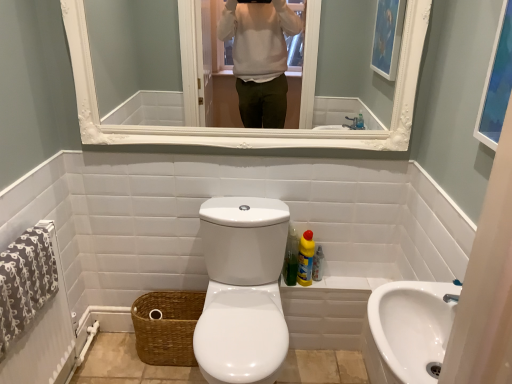
Where is `vacant space positioned to the left of brown woven basket at lower left`? The height and width of the screenshot is (384, 512). vacant space positioned to the left of brown woven basket at lower left is located at coordinates (116, 354).